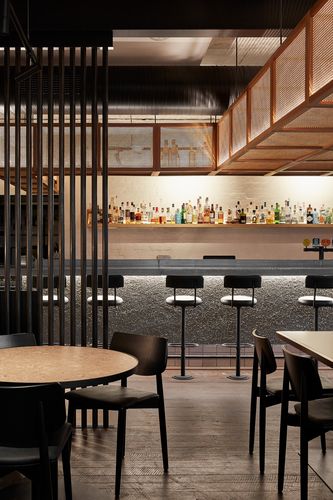
Find the location of a particular element. Image resolution: width=333 pixels, height=500 pixels. dark hardwood flooring is located at coordinates (211, 456).